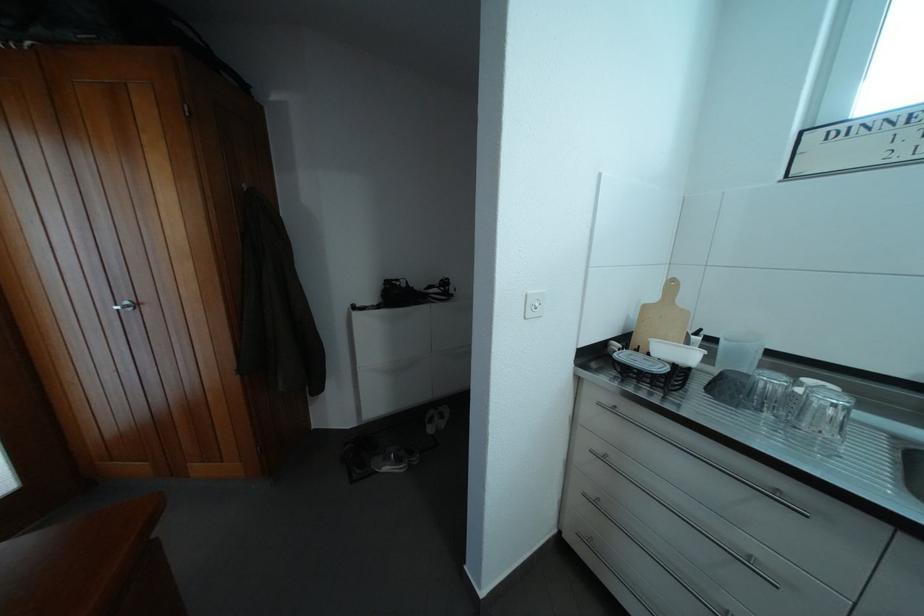
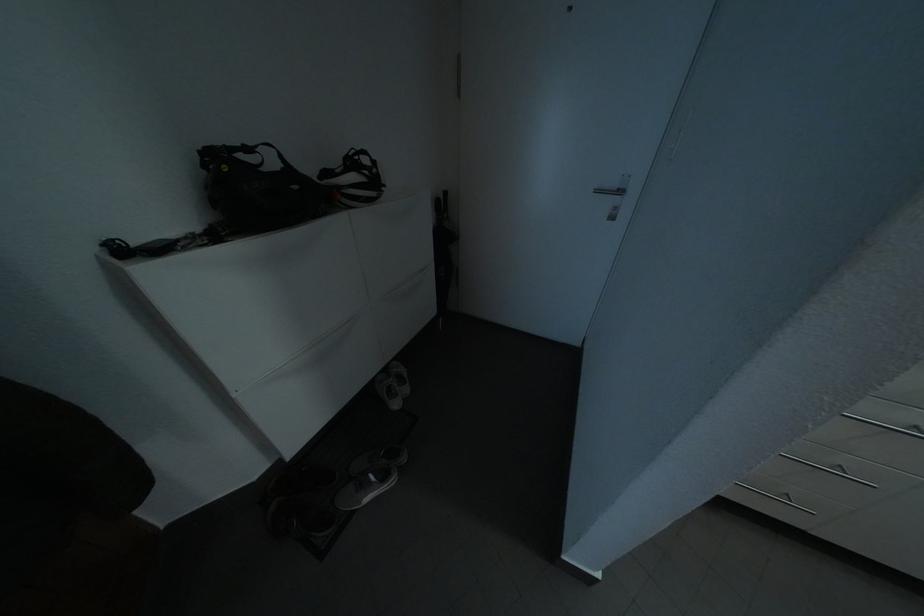
Find the pixel in the second image that matches [438,300] in the first image.

(348, 193)